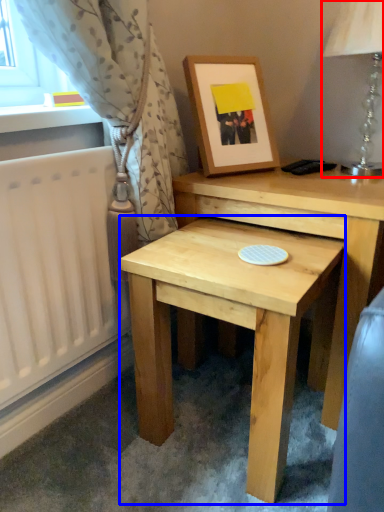
Question: Among these objects, which one is farthest to the camera, table lamp (highlighted by a red box) or table (highlighted by a blue box)?

Choices:
 (A) table lamp
 (B) table

Answer: (A)